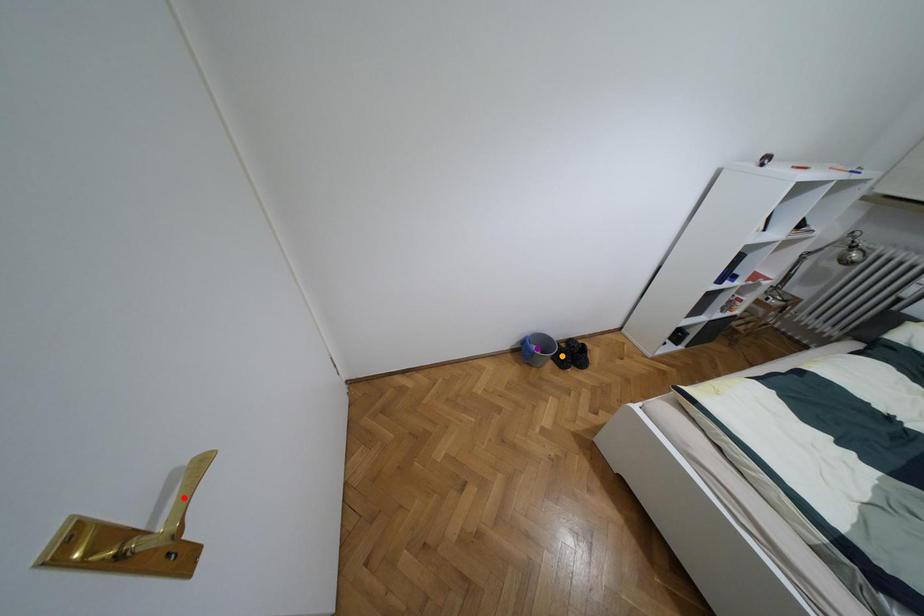
Order these from nearest to farthest:
purple point | orange point | red point

red point → orange point → purple point